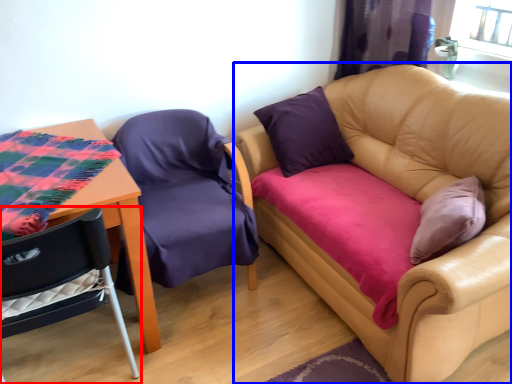
Question: Which object appears farthest to the camera in this image, chair (highlighted by a red box) or studio couch (highlighted by a blue box)?

Choices:
 (A) chair
 (B) studio couch

Answer: (A)